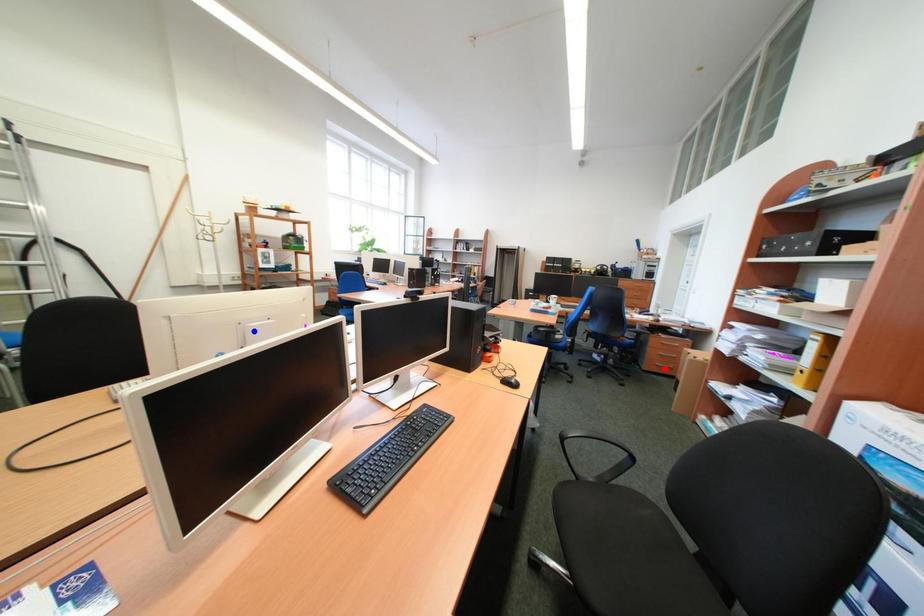
Question: In the image, two points are highlighted. Which point is nearer to the camera? Reply with the corresponding letter.

Choices:
 (A) blue point
 (B) red point

Answer: (A)